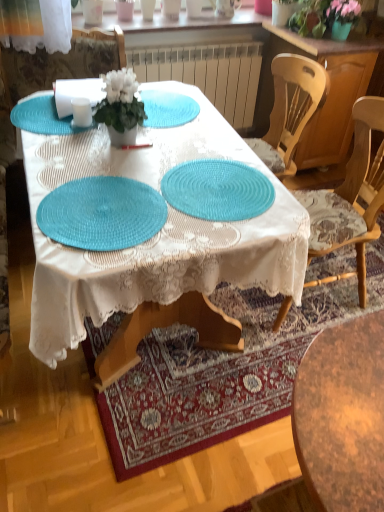
Where is `free space in front of teal woven placemat at center, which ranks as the second glass plate in top-to-bottom order`? Image resolution: width=384 pixels, height=512 pixels. free space in front of teal woven placemat at center, which ranks as the second glass plate in top-to-bottom order is located at coordinates (192, 241).